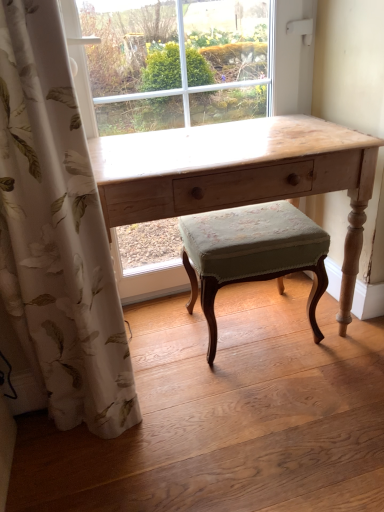
Question: Is white floral fabric curtain at left facing towards green fabric stool at center?

Choices:
 (A) yes
 (B) no

Answer: (B)

Question: Is white floral fabric curtain at left at the right side of green fabric stool at center?

Choices:
 (A) yes
 (B) no

Answer: (B)

Question: Is the position of white floral fabric curtain at left more distant than that of green fabric stool at center?

Choices:
 (A) no
 (B) yes

Answer: (A)

Question: Is white floral fabric curtain at left touching green fabric stool at center?

Choices:
 (A) no
 (B) yes

Answer: (A)

Question: Is white floral fabric curtain at left not inside green fabric stool at center?

Choices:
 (A) no
 (B) yes

Answer: (B)

Question: From the image's perspective, does white floral fabric curtain at left appear higher than green fabric stool at center?

Choices:
 (A) yes
 (B) no

Answer: (A)

Question: Does light wood desk at center have a greater height compared to green fabric stool at center?

Choices:
 (A) yes
 (B) no

Answer: (A)

Question: From the image's perspective, is light wood desk at center over green fabric stool at center?

Choices:
 (A) no
 (B) yes

Answer: (B)

Question: Does light wood desk at center have a larger size compared to green fabric stool at center?

Choices:
 (A) no
 (B) yes

Answer: (B)

Question: Does light wood desk at center turn towards green fabric stool at center?

Choices:
 (A) yes
 (B) no

Answer: (A)

Question: Is light wood desk at center outside green fabric stool at center?

Choices:
 (A) yes
 (B) no

Answer: (A)

Question: Does light wood desk at center appear on the left side of green fabric stool at center?

Choices:
 (A) no
 (B) yes

Answer: (B)

Question: Does green fabric stool at center have a greater width compared to light wood desk at center?

Choices:
 (A) yes
 (B) no

Answer: (B)